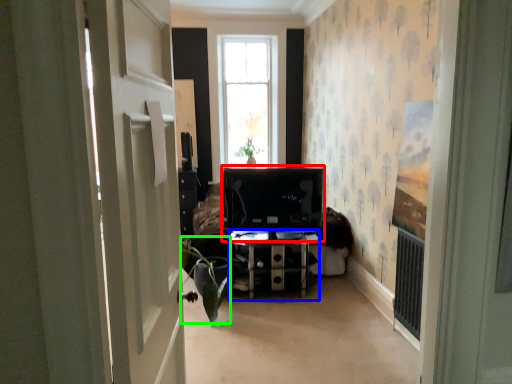
Question: Considering the real-world distances, which object is farthest from computer monitor (highlighted by a red box)? furniture (highlighted by a blue box) or plant (highlighted by a green box)?

Choices:
 (A) furniture
 (B) plant

Answer: (B)